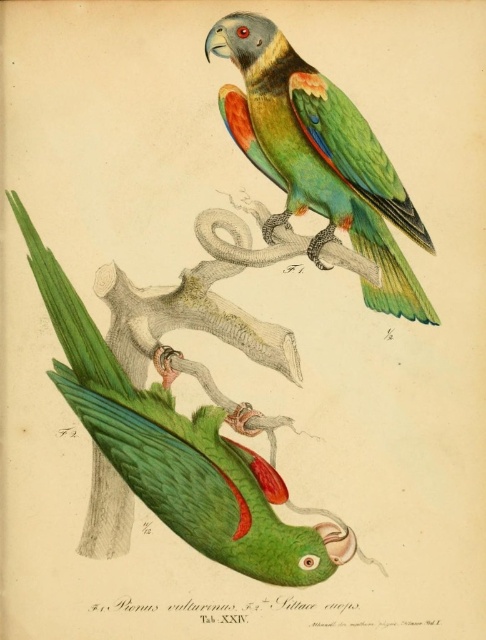
From the picture: Which is below, green matte parrot at lower left or green matte parrot at center?

green matte parrot at lower left is below.

Who is more forward, (97,349) or (301,84)?

Point (301,84) is in front.

You are a GUI agent. You are given a task and a screenshot of the screen. Output one action in this format:
    pyautogui.click(x=<x>, y=<y>)
    Task: Click on the green matte parrot at lower left
    The height and width of the screenshot is (640, 486).
    Given the screenshot: What is the action you would take?
    pyautogui.click(x=177, y=451)